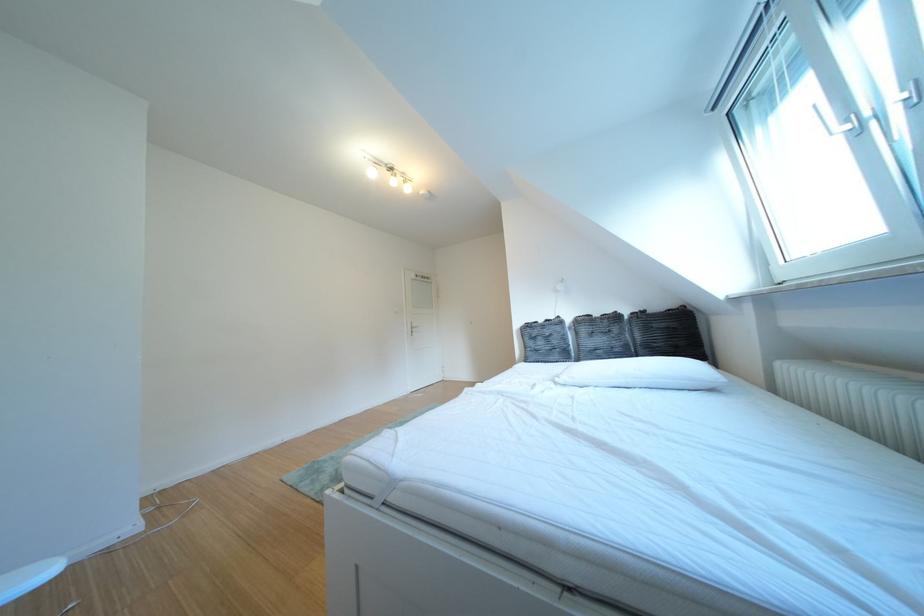
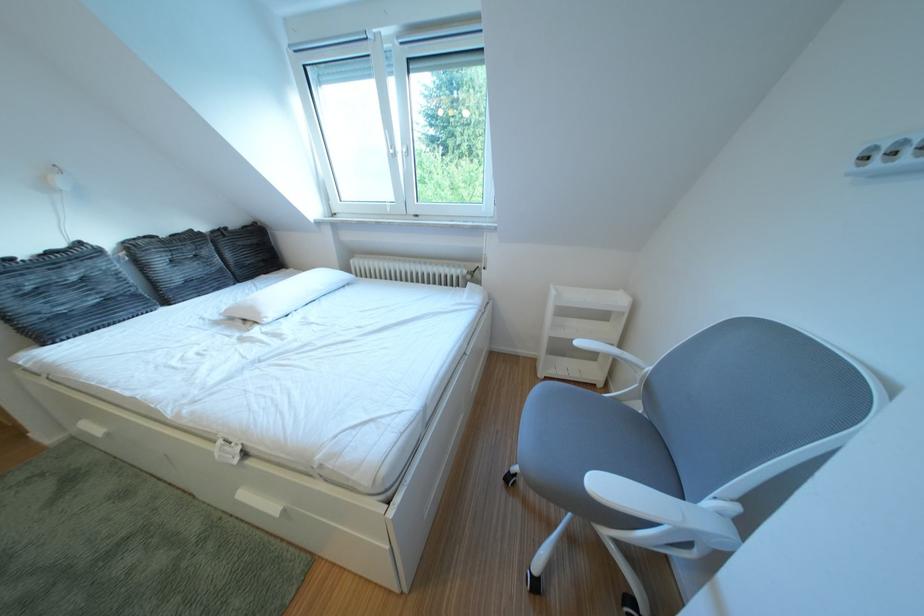
Find the pixel in the second image that matches point (573, 323) in the first image.

(93, 249)